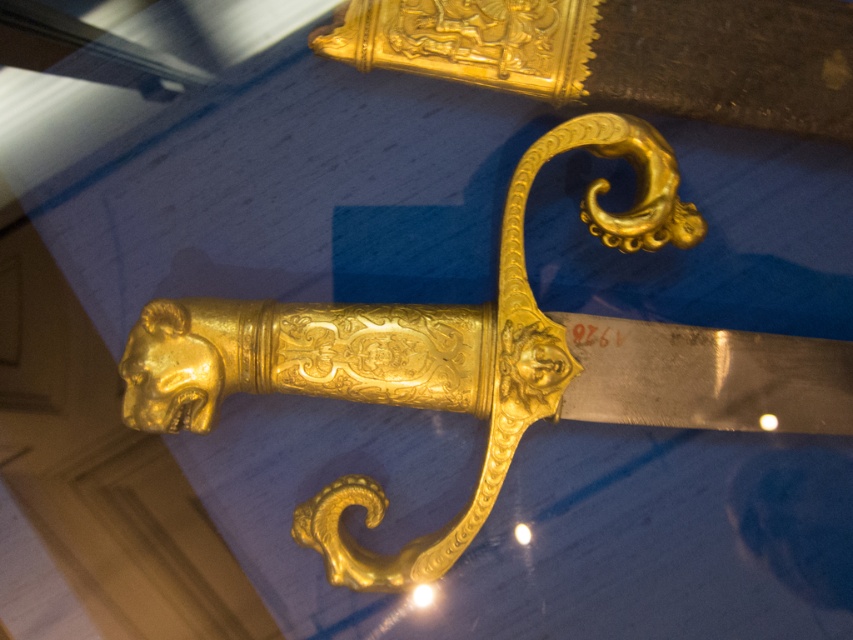
You are a museum curator planning to install a protective glass case around the gold polished sword at center. The case must be positioned precisely at the sword location. What are the coordinates where you should place the case?

The gold polished sword at center is located at coordinates point (486, 360), so the protective glass case should be placed at those coordinates to ensure it surrounds the sword properly.

You are a museum security guard standing at the camera position. You need to reach the gold polished sword at center to inspect it. Can you reach it without moving your feet?

The gold polished sword at center and camera are 1.19 meters apart from each other, so you cannot reach it without moving your feet since the distance is too far.